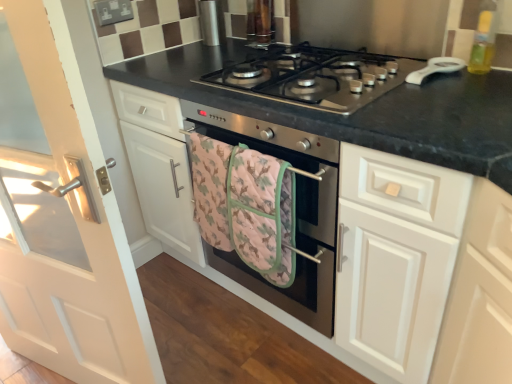
Identify the location of free spot to the right of white glossy door at left. (216, 342).